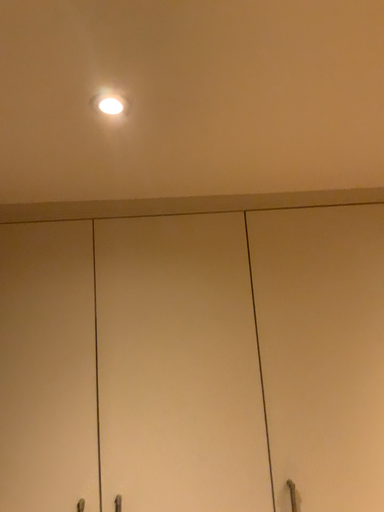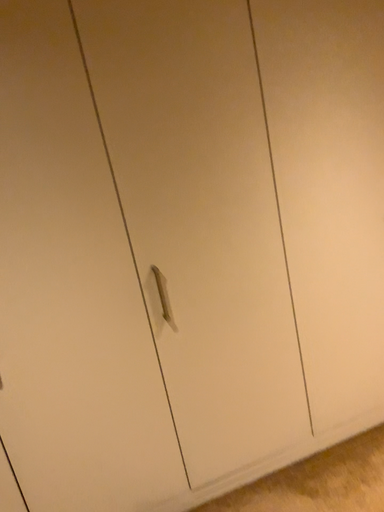
Question: How did the camera likely rotate when shooting the video?

Choices:
 (A) rotated upward
 (B) rotated downward

Answer: (B)